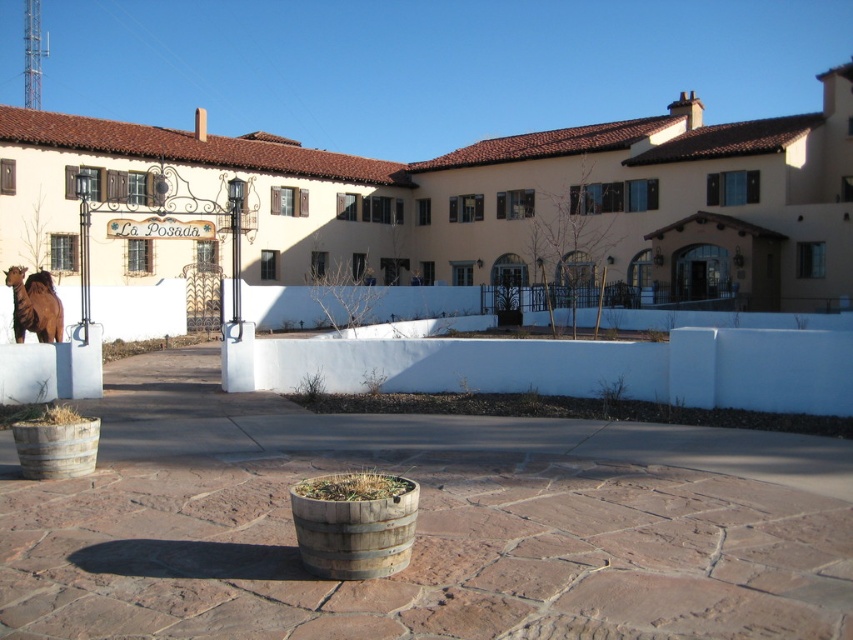
From the picture: You are a visitor standing in front of the building. You want to place a small potted plant on the shorter object between the rustic wooden barrel at lower left and the brown wooden hay at center. Which object should you choose?

The brown wooden hay at center is shorter than the rustic wooden barrel at lower left, so you should place the small potted plant on the brown wooden hay at center.

You are standing in the courtyard of La Posada and want to place a new bench between the rustic wood barrel at center and the brown matte camel at left. Based on their positions, which object should the bench be closer to?

The bench should be closer to the brown matte camel at left because the rustic wood barrel at center is closer to the viewer, meaning the camel is further back. To place the bench between them, it needs to be nearer to the camel to maintain the spatial arrangement.

You are a visitor approaching the entrance of La Posada. You see the rustic wooden barrel at lower left and the brown wooden hay at center. Which object is closer to the entrance?

The rustic wooden barrel at lower left is closer to the entrance because it is positioned under the brown wooden hay at center, meaning it is in front of it.